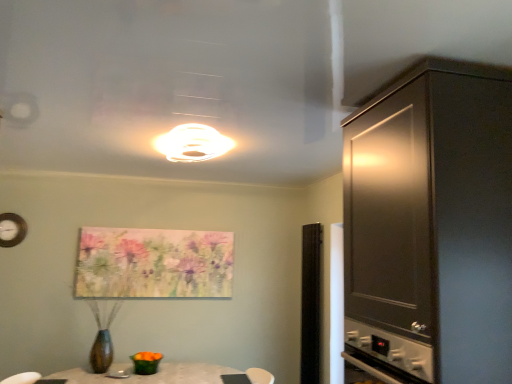
Find the location of a particular element. vacant area on top of white glossy light fixture at upper center (from a real-world perspective) is located at coordinates (192, 142).